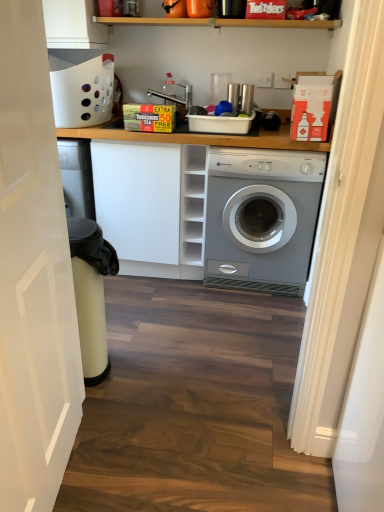
Question: Is point (48, 174) positioned closer to the camera than point (314, 212)?

Choices:
 (A) closer
 (B) farther

Answer: (A)

Question: In the image, is white matte door at left on the left side or the right side of silver metallic washing machine at center-right?

Choices:
 (A) left
 (B) right

Answer: (A)

Question: Which object is positioned closest to the white matte cabinet at center?

Choices:
 (A) silver metallic washing machine at center-right
 (B) white matte door at left

Answer: (A)

Question: Estimate the real-world distances between objects in this image. Which object is farther from the white matte cabinet at center?

Choices:
 (A) white matte door at left
 (B) silver metallic washing machine at center-right

Answer: (A)